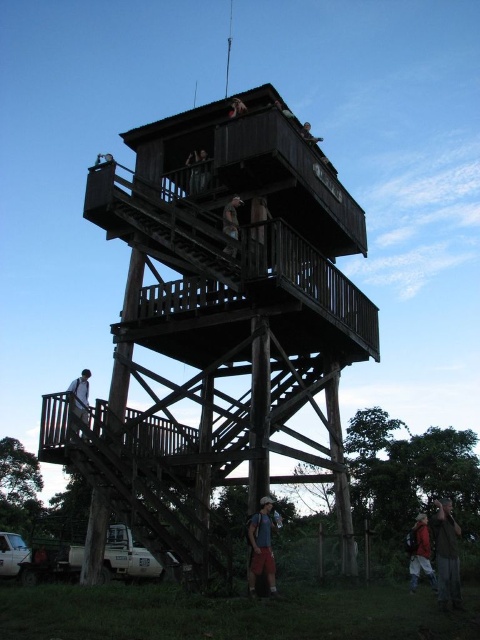
Question: Based on their relative distances, which object is farther from the wooden person at center?

Choices:
 (A) wooden stairs at center
 (B) brown fabric shirt at lower right
 (C) matte black person at upper center

Answer: (B)

Question: Does matte black person at upper center have a greater width compared to wooden helmet at upper center?

Choices:
 (A) yes
 (B) no

Answer: (B)

Question: Which of these objects is positioned farthest from the red fabric backpack at lower right?

Choices:
 (A) blue fabric backpack at lower center
 (B) wooden helmet at upper center
 (C) wooden person at center
 (D) matte black person at upper center

Answer: (B)

Question: Is red fabric backpack at lower right in front of wooden person at center?

Choices:
 (A) no
 (B) yes

Answer: (A)

Question: Is dark wood observation tower at center to the right of red fabric backpack at lower right from the viewer's perspective?

Choices:
 (A) no
 (B) yes

Answer: (A)

Question: Which object is farther from the camera taking this photo?

Choices:
 (A) blue fabric backpack at lower center
 (B) wooden stairs at center
 (C) wooden person at center

Answer: (C)